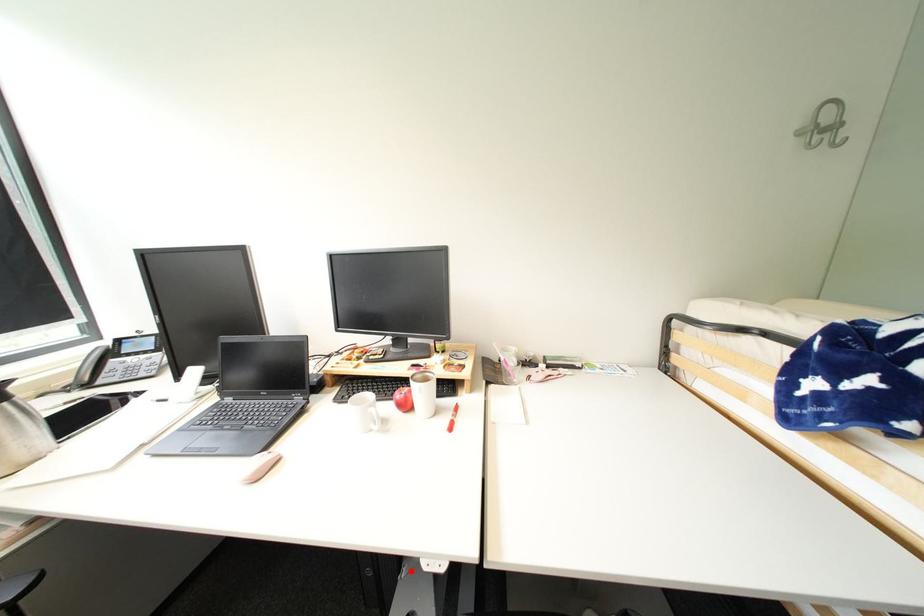
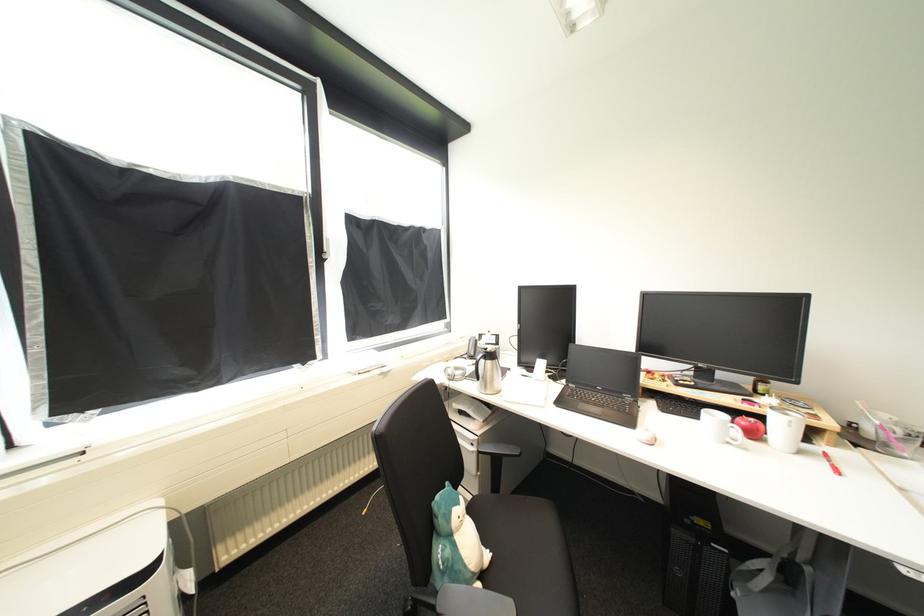
Find the pixel in the second image that matches the highlighted location in the first image.

(745, 591)